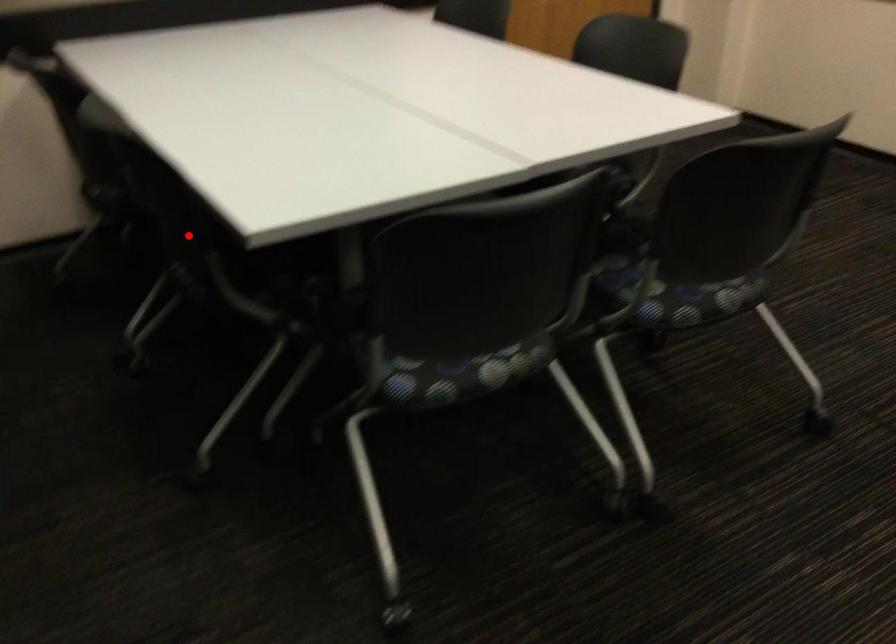
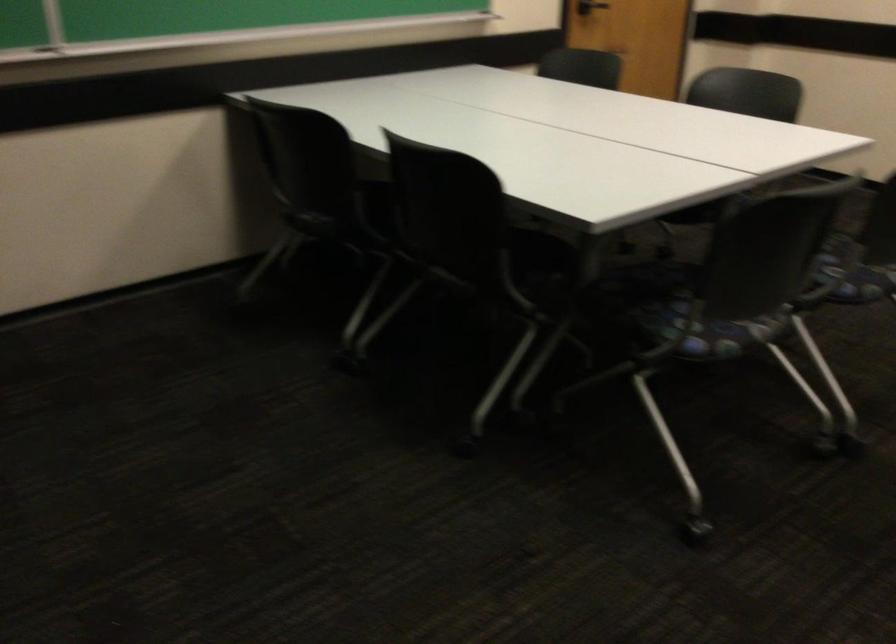
Where in the second image is the point corresponding to the highlighted location from the first image?

(455, 245)